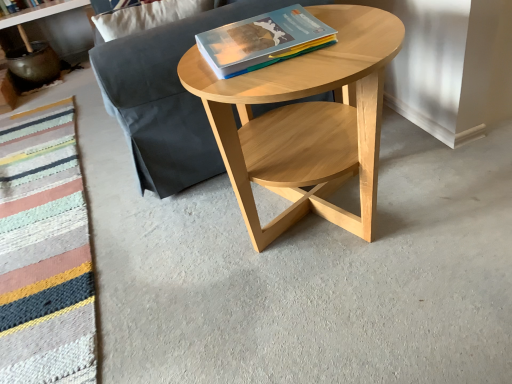
Where is `free region on the left part of natural wood coffee table at center`? The image size is (512, 384). free region on the left part of natural wood coffee table at center is located at coordinates (166, 254).